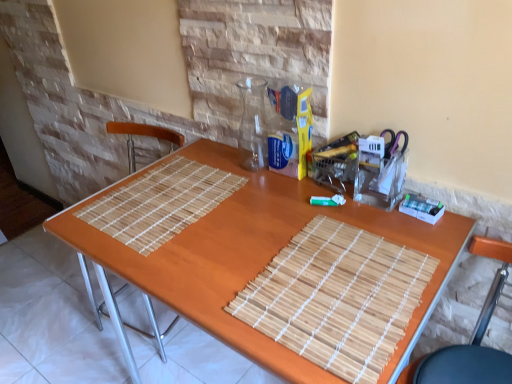
Question: Considering the relative sizes of wooden chair at lower right and wooden table at center in the image provided, is wooden chair at lower right smaller than wooden table at center?

Choices:
 (A) no
 (B) yes

Answer: (B)

Question: Is wooden chair at lower right further to camera compared to wooden table at center?

Choices:
 (A) no
 (B) yes

Answer: (A)

Question: Does wooden chair at lower right have a greater height compared to wooden table at center?

Choices:
 (A) no
 (B) yes

Answer: (A)

Question: From the image's perspective, is wooden chair at lower right over wooden table at center?

Choices:
 (A) yes
 (B) no

Answer: (B)

Question: Is there a large distance between wooden chair at lower right and wooden table at center?

Choices:
 (A) no
 (B) yes

Answer: (A)

Question: Does wooden chair at lower right have a larger size compared to wooden table at center?

Choices:
 (A) yes
 (B) no

Answer: (B)

Question: Considering the relative positions of wooden table at center and wooden chair at lower right in the image provided, is wooden table at center to the left of wooden chair at lower right from the viewer's perspective?

Choices:
 (A) yes
 (B) no

Answer: (A)

Question: Is wooden table at center positioned in front of wooden chair at lower right?

Choices:
 (A) no
 (B) yes

Answer: (A)

Question: Is wooden table at center taller than wooden chair at lower right?

Choices:
 (A) yes
 (B) no

Answer: (A)

Question: Is wooden chair at lower right a part of wooden table at center?

Choices:
 (A) yes
 (B) no

Answer: (B)

Question: Considering the relative sizes of wooden table at center and wooden chair at lower right in the image provided, is wooden table at center shorter than wooden chair at lower right?

Choices:
 (A) yes
 (B) no

Answer: (B)

Question: Is wooden table at center smaller than wooden chair at lower right?

Choices:
 (A) yes
 (B) no

Answer: (B)

Question: Relative to wooden table at center, is wooden chair at lower right in front or behind?

Choices:
 (A) front
 (B) behind

Answer: (A)